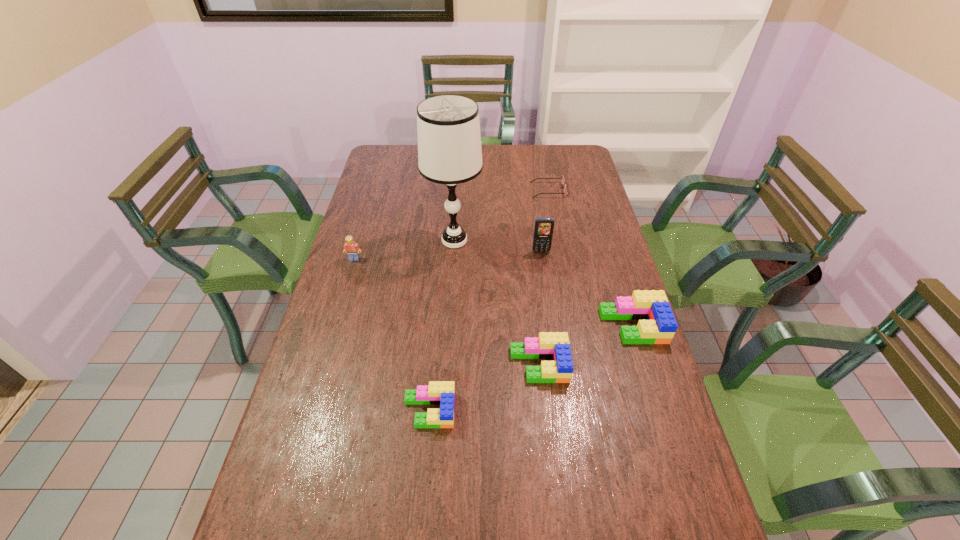
The image size is (960, 540). I want to click on the nearest Lego, so click(x=437, y=392).

This screenshot has width=960, height=540. Identify the location of the second Lego from left to right. (437, 392).

Locate an element on the screen. The image size is (960, 540). the third farthest Lego is located at coordinates (550, 345).

Find the location of a particular element. The image size is (960, 540). the third tallest Lego is located at coordinates (550, 345).

At what (x,y) coordinates should I click in order to perform the action: click on the rightmost Lego. Please return your answer as a coordinate pair (x, y). The image size is (960, 540). Looking at the image, I should click on (657, 325).

In order to click on the fifth farthest object in this screenshot , I will do `click(657, 325)`.

Identify the location of the tallest object. Image resolution: width=960 pixels, height=540 pixels. (448, 128).

In order to click on cellular telephone in this screenshot , I will do `click(543, 231)`.

The image size is (960, 540). I want to click on the leftmost object, so point(352,248).

Locate an element on the screen. Image resolution: width=960 pixels, height=540 pixels. the leftmost Lego is located at coordinates [352, 248].